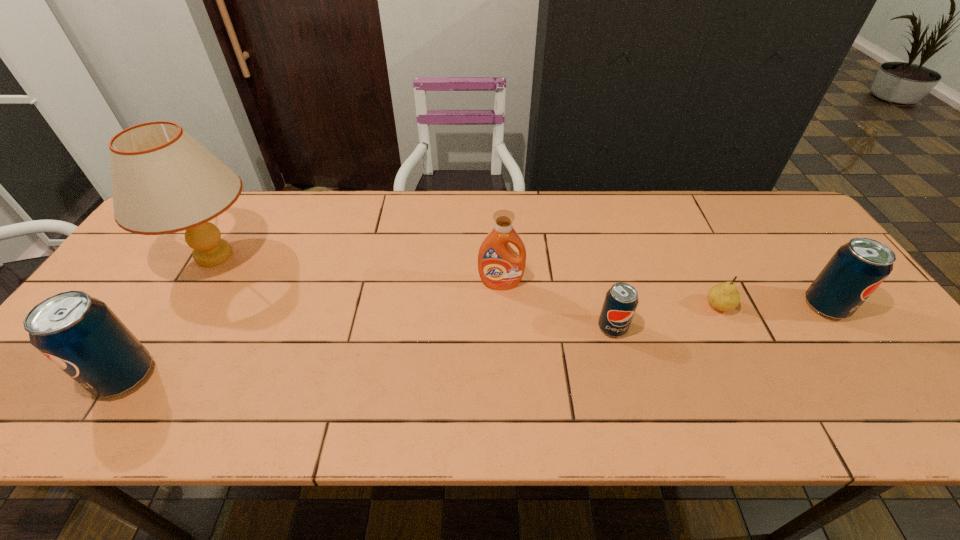
Where is `free space for an extra pop_(soda) to achieve even spacing`? This screenshot has width=960, height=540. free space for an extra pop_(soda) to achieve even spacing is located at coordinates (379, 351).